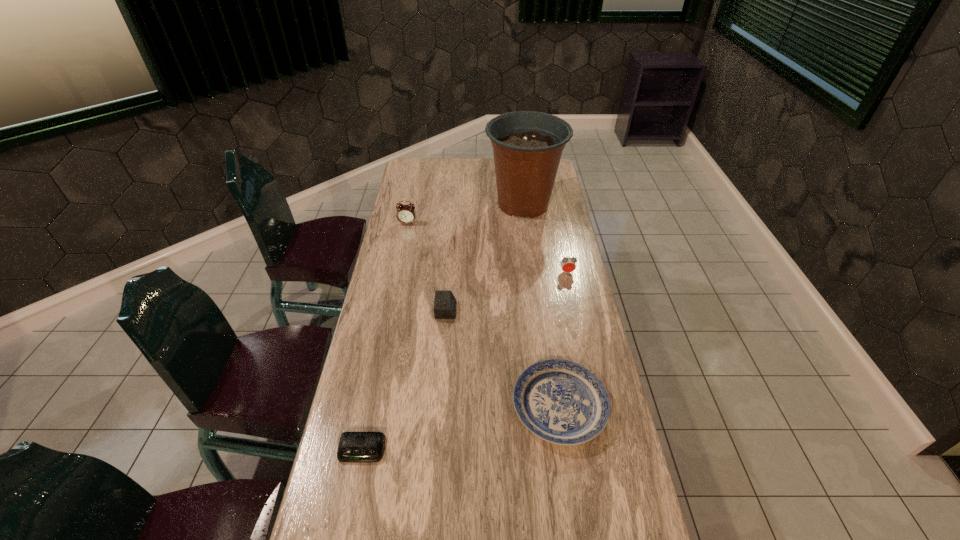
You are a GUI agent. You are given a task and a screenshot of the screen. Output one action in this format:
    pyautogui.click(x=<x>, y=<y>)
    Task: Click on the vacant area that lies between the plate and the second tallest alarm clock
    
    Given the screenshot: What is the action you would take?
    pyautogui.click(x=564, y=339)

Where is `free area in between the tallest alarm clock and the rightmost alarm clock`? The height and width of the screenshot is (540, 960). free area in between the tallest alarm clock and the rightmost alarm clock is located at coordinates (488, 248).

Image resolution: width=960 pixels, height=540 pixels. Identify the location of object that stands as the second closest to the nearest alarm clock. (445, 303).

Locate which object is the fourth closest to the third nearest alarm clock. Please provide its 2D coordinates. Your answer should be formatted as a tuple, i.e. [(x, y)], where the tuple contains the x and y coordinates of a point satisfying the conditions above.

[(406, 214)]

Select which alarm clock appears as the third closest to the second shortest object. Please provide its 2D coordinates. Your answer should be formatted as a tuple, i.e. [(x, y)], where the tuple contains the x and y coordinates of a point satisfying the conditions above.

[(568, 265)]

Select which alarm clock appears as the second closest to the fourth tallest object. Please provide its 2D coordinates. Your answer should be formatted as a tuple, i.e. [(x, y)], where the tuple contains the x and y coordinates of a point satisfying the conditions above.

[(355, 447)]

The height and width of the screenshot is (540, 960). I want to click on vacant space that satisfies the following two spatial constraints: 1. on the front-facing side of the third tallest alarm clock; 2. on the display of the shortest alarm clock, so click(435, 450).

Locate an element on the screen. The width and height of the screenshot is (960, 540). blank area in the image that satisfies the following two spatial constraints: 1. on the face of the third farthest object; 2. on the front-facing side of the third nearest object is located at coordinates (575, 310).